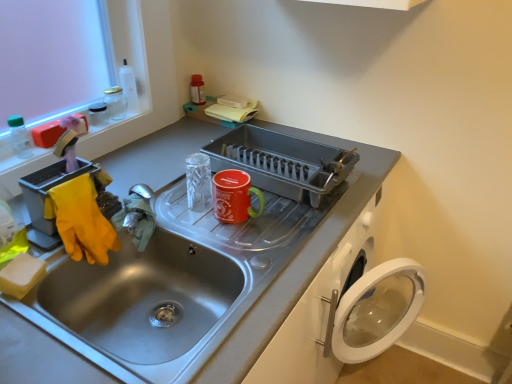
Question: Can you confirm if glossy ceramic mug at upper center, arranged as the 2th appliance when viewed from the left, is taller than stainless steel sink at center?

Choices:
 (A) no
 (B) yes

Answer: (A)

Question: Is glossy ceramic mug at upper center, arranged as the 2th appliance when viewed from the left, outside stainless steel sink at center?

Choices:
 (A) yes
 (B) no

Answer: (B)

Question: Is glossy ceramic mug at upper center, the second appliance in the right-to-left sequence, looking in the opposite direction of stainless steel sink at center?

Choices:
 (A) no
 (B) yes

Answer: (B)

Question: Can you confirm if glossy ceramic mug at upper center, arranged as the 2th appliance when viewed from the left, is shorter than stainless steel sink at center?

Choices:
 (A) no
 (B) yes

Answer: (B)

Question: Is glossy ceramic mug at upper center, arranged as the 2th appliance when viewed from the left, to the left of stainless steel sink at center from the viewer's perspective?

Choices:
 (A) no
 (B) yes

Answer: (A)

Question: Can you confirm if glossy ceramic mug at upper center, the second appliance in the right-to-left sequence, is positioned to the right of stainless steel sink at center?

Choices:
 (A) yes
 (B) no

Answer: (A)

Question: Does metallic gray dish rack at center, the third appliance from the left, have a greater height compared to transparent plastic bottle at upper left?

Choices:
 (A) no
 (B) yes

Answer: (B)

Question: From a real-world perspective, is metallic gray dish rack at center, which is the first appliance in right-to-left order, located beneath transparent plastic bottle at upper left?

Choices:
 (A) yes
 (B) no

Answer: (A)

Question: Is the depth of metallic gray dish rack at center, the third appliance from the left, greater than that of transparent plastic bottle at upper left?

Choices:
 (A) yes
 (B) no

Answer: (B)

Question: Is metallic gray dish rack at center, the third appliance from the left, positioned beyond the bounds of transparent plastic bottle at upper left?

Choices:
 (A) no
 (B) yes

Answer: (B)

Question: Could you tell me if metallic gray dish rack at center, the third appliance from the left, is turned towards transparent plastic bottle at upper left?

Choices:
 (A) yes
 (B) no

Answer: (B)

Question: Is the surface of metallic gray dish rack at center, which is the first appliance in right-to-left order, in direct contact with transparent plastic bottle at upper left?

Choices:
 (A) no
 (B) yes

Answer: (A)

Question: From the image's perspective, is glossy ceramic mug at upper center, arranged as the 2th appliance when viewed from the left, beneath transparent plastic bottle at upper left?

Choices:
 (A) yes
 (B) no

Answer: (A)